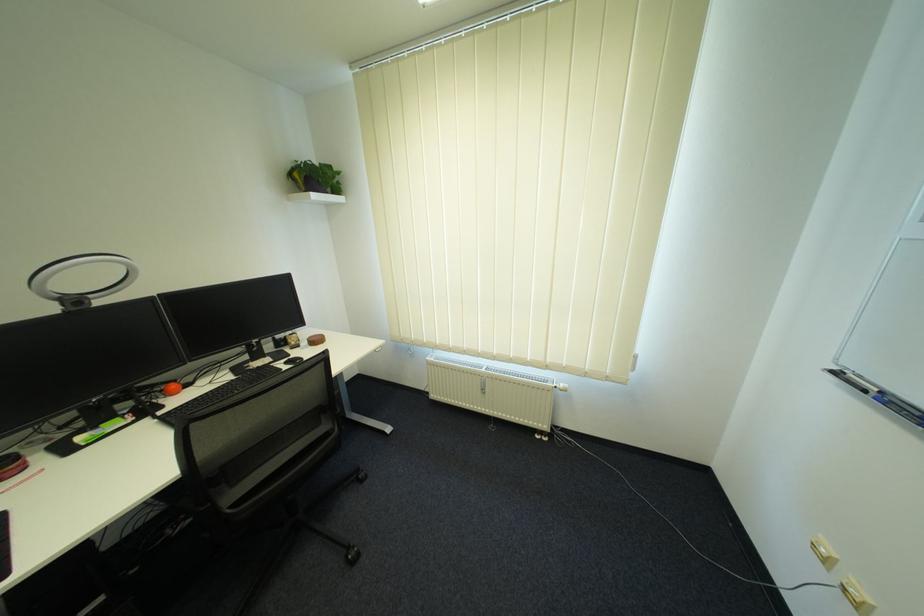
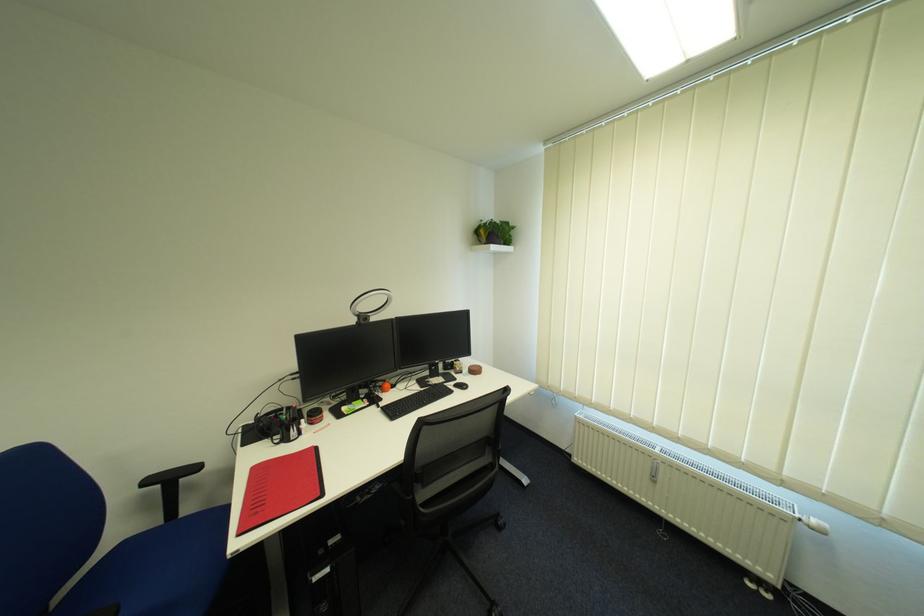
In the second image, find the point that corresponds to (x=493, y=394) in the first image.

(664, 483)